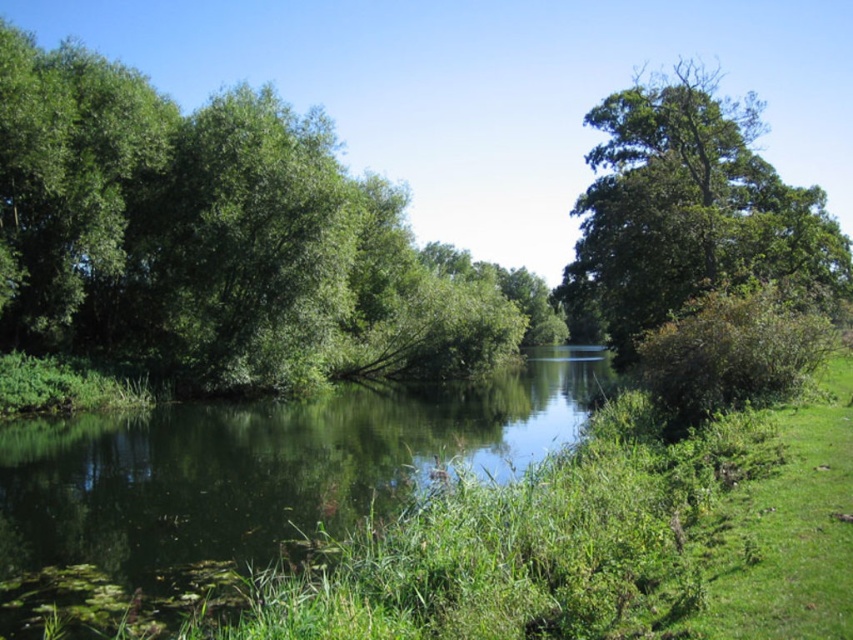
You are standing at the edge of the river in the image and want to throw a stone. You have two target points marked as point 1 at coordinates point (236, 276) and point 2 at coordinates point (6, 428). Which point will the stone land closer to you if you throw it with the same force and angle?

Point 1 at coordinates point (236, 276) will be closer to you because it is further to the camera than point 2 at coordinates point (6, 428), meaning it is physically closer to your position at the edge of the river.

You are standing at the edge of the green grassy river at center and want to see the green leafy tree at upper right. Is the tree taller than the river from your current position?

The green grassy river at center is shorter than the green leafy tree at upper right, so yes, the tree is taller than the river from your current position.

You are standing at the edge of the green grassy river at center, and you want to throw a stone into the water. The stone requires a minimum of 7 meters to reach the water. Is the distance sufficient?

The green grassy river at center is 8.40 meters away from you, so yes, the distance is sufficient to throw the stone as it exceeds the required 7 meters.